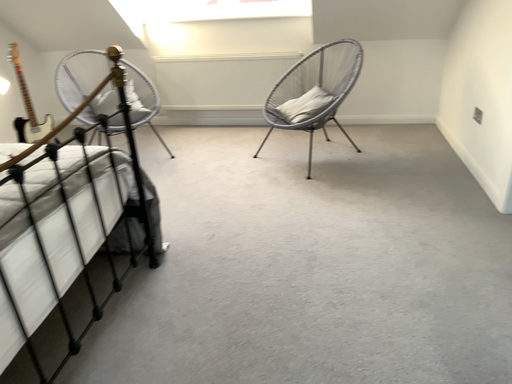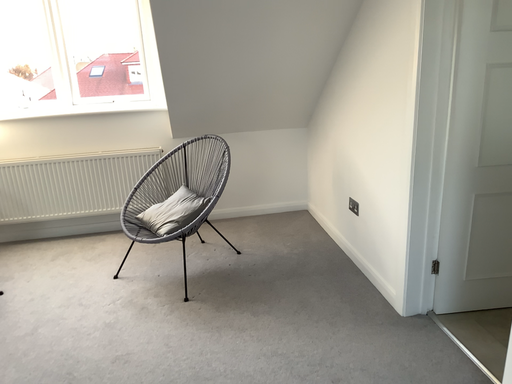
Question: Which way did the camera rotate in the video?

Choices:
 (A) rotated upward
 (B) rotated downward

Answer: (A)